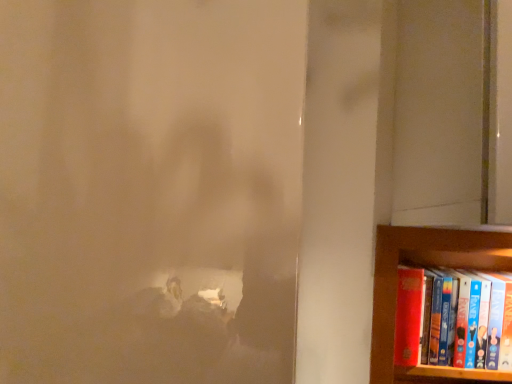
Image resolution: width=512 pixels, height=384 pixels. What do you see at coordinates (441, 320) in the screenshot? I see `hardcover book at right` at bounding box center [441, 320].

In order to click on hardcover book at right in this screenshot , I will do `click(441, 320)`.

At what (x,y) coordinates should I click in order to perform the action: click on hardcover book at right. Please return your answer as a coordinate pair (x, y). Looking at the image, I should click on (441, 320).